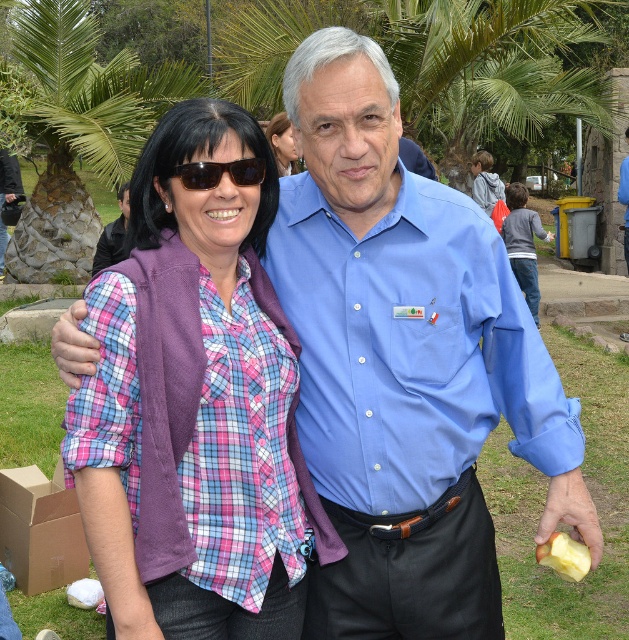
Is plaid fabric shirt at center to the left of sunglasses at center from the viewer's perspective?

Indeed, plaid fabric shirt at center is positioned on the left side of sunglasses at center.

Is point (143, 241) more distant than point (213, 163)?

Yes, point (143, 241) is farther from viewer.

Image resolution: width=629 pixels, height=640 pixels. Identify the location of plaid fabric shirt at center. (201, 358).

Which of these two, green leafy palm tree at upper left or matte purple vest at center, stands shorter?

Standing shorter between the two is matte purple vest at center.

Who is more distant from viewer, (74,237) or (120,244)?

The point (74,237) is more distant.

Which is in front, point (67, 173) or point (123, 224)?

Point (123, 224) is more forward.

Where is `green leafy palm tree at upper left`? The image size is (629, 640). green leafy palm tree at upper left is located at coordinates (70, 136).

Is point (420, 481) farther from camera compared to point (292, 170)?

That is False.

Which is below, blue cotton shirt at center or matte black hair at upper center?

blue cotton shirt at center is below.

Is point (314, 248) farther from camera compared to point (284, 172)?

No, (314, 248) is in front of (284, 172).

Where is `blue cotton shirt at center`? blue cotton shirt at center is located at coordinates (409, 348).